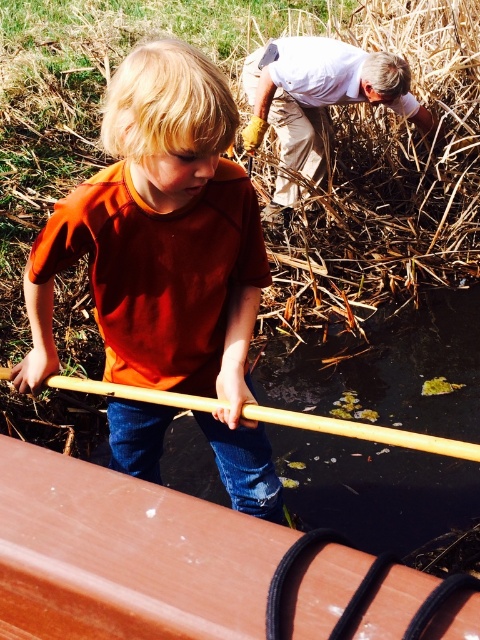
Is brown straw at upper center above brown wood canoe at lower left?

Correct, brown straw at upper center is located above brown wood canoe at lower left.

Can you confirm if brown straw at upper center is taller than brown wood canoe at lower left?

Yes, brown straw at upper center is taller than brown wood canoe at lower left.

Which is in front, point (197, 10) or point (113, 557)?

Point (113, 557) is more forward.

Image resolution: width=480 pixels, height=640 pixels. Identify the location of brown straw at upper center. (240, 129).

Is orange matte shirt at center to the left of brown wood canoe at lower left from the viewer's perspective?

Yes, orange matte shirt at center is to the left of brown wood canoe at lower left.

Is point (126, 205) farther from camera compared to point (322, 589)?

Yes, it is.

Identify the location of orange matte shirt at center. (167, 257).

Measure the distance from brown straw at upper center to orange matte shirt at center.

brown straw at upper center is 4.46 meters from orange matte shirt at center.

Locate an element on the screen. The height and width of the screenshot is (640, 480). brown straw at upper center is located at coordinates (240, 129).

The image size is (480, 640). In order to click on brown straw at upper center in this screenshot , I will do `click(240, 129)`.

Where is `brown straw at upper center`? This screenshot has width=480, height=640. brown straw at upper center is located at coordinates (240, 129).